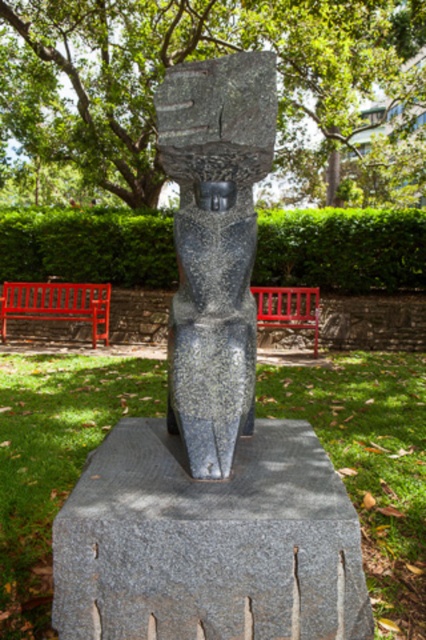
Between point (359, 618) and point (0, 264), which one is positioned in front?

Point (359, 618) is more forward.

Is gray granite pedestal at center smaller than green leafy hedge at center?

Yes.

The height and width of the screenshot is (640, 426). In order to click on gray granite pedestal at center in this screenshot , I will do `click(209, 541)`.

Does gray granite pedestal at center have a smaller size compared to red wooden bench at center?

Correct, gray granite pedestal at center occupies less space than red wooden bench at center.

Is point (106, 602) more distant than point (8, 298)?

No, (106, 602) is closer to viewer.

Locate an element on the screen. This screenshot has height=640, width=426. gray granite pedestal at center is located at coordinates (209, 541).

Consider the image. Does granite statue at center have a greater height compared to green leafy hedge at center?

Incorrect, granite statue at center's height is not larger of green leafy hedge at center's.

Is granite statue at center further to camera compared to green leafy hedge at center?

No, granite statue at center is closer to the viewer.

The width and height of the screenshot is (426, 640). In order to click on granite statue at center in this screenshot , I will do `click(215, 244)`.